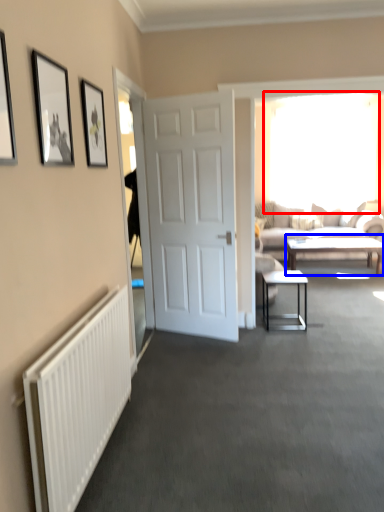
Question: Which point is further to the camera, window (highlighted by a red box) or coffee table (highlighted by a blue box)?

Choices:
 (A) window
 (B) coffee table

Answer: (A)